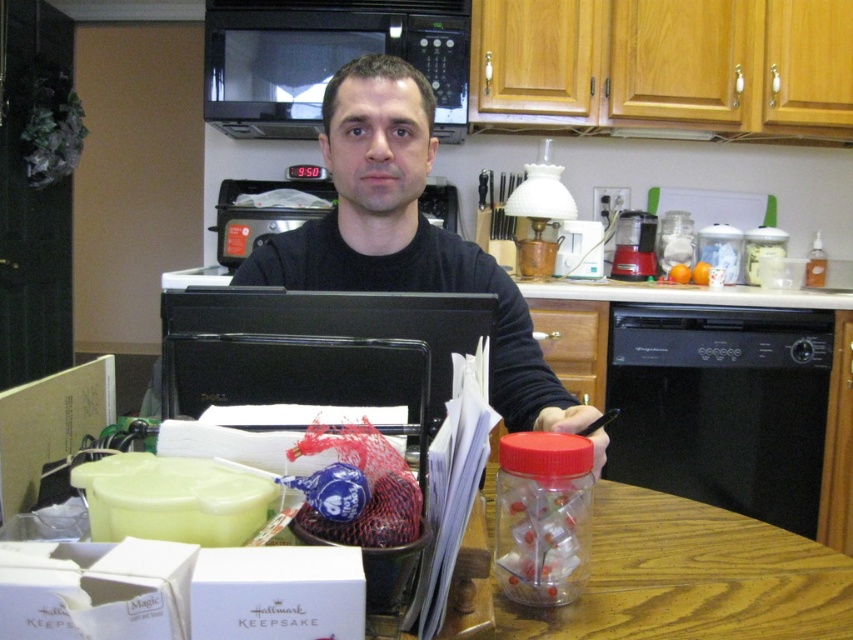
Who is higher up, black matte shirt at center or translucent plastic jar at center?

black matte shirt at center is higher up.

Is black matte shirt at center wider than translucent plastic jar at center?

Correct, the width of black matte shirt at center exceeds that of translucent plastic jar at center.

Describe the element at coordinates (405, 234) in the screenshot. I see `black matte shirt at center` at that location.

I want to click on black matte shirt at center, so pos(405,234).

Does wooden table at center appear on the left side of black matte microwave at upper center?

No, wooden table at center is not to the left of black matte microwave at upper center.

Can you confirm if wooden table at center is positioned above black matte microwave at upper center?

Actually, wooden table at center is below black matte microwave at upper center.

This screenshot has width=853, height=640. I want to click on wooden table at center, so click(x=692, y=579).

Between black matte shirt at center and black matte microwave at upper center, which one is positioned higher?

Positioned higher is black matte microwave at upper center.

Is point (540, 353) closer to viewer compared to point (456, 49)?

Yes, it is in front of point (456, 49).

Between point (431, 276) and point (368, 35), which one is positioned behind?

The point (368, 35) is behind.

At what (x,y) coordinates should I click in order to perform the action: click on black matte shirt at center. Please return your answer as a coordinate pair (x, y). This screenshot has height=640, width=853. Looking at the image, I should click on (405, 234).